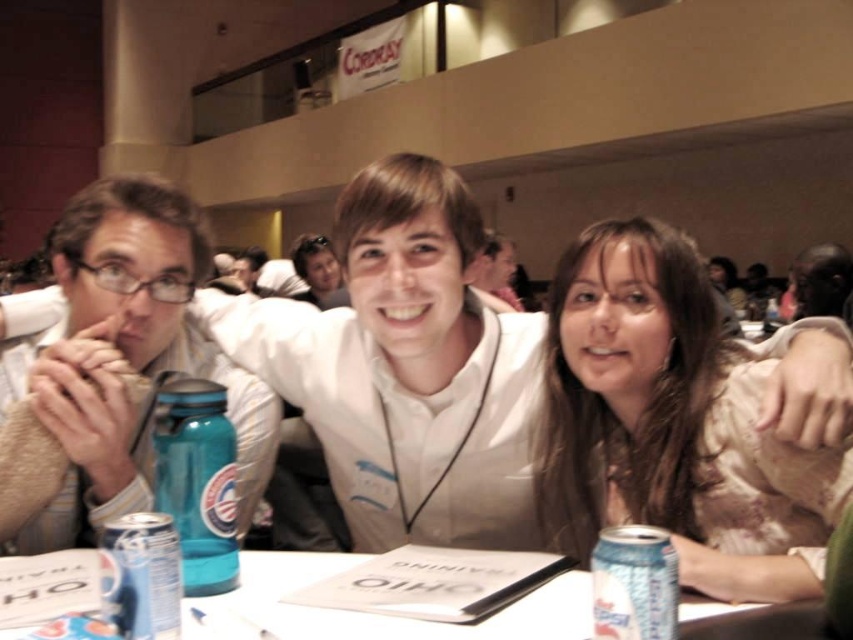
Does point (381, 257) lie behind point (809, 264)?

No, (381, 257) is in front of (809, 264).

Find the location of a particular element. This screenshot has height=640, width=853. matte white shirt at center is located at coordinates (405, 365).

Does point (206, 600) lie in front of point (137, 600)?

No, (206, 600) is further to viewer.

Is point (260, 628) in front of point (146, 598)?

No, (260, 628) is behind (146, 598).

You are a GUI agent. You are given a task and a screenshot of the screen. Output one action in this format:
    pyautogui.click(x=<x>, y=<y>)
    Task: Click on the clear plastic can at lower center
    This screenshot has width=853, height=640.
    Given the screenshot: What is the action you would take?
    pyautogui.click(x=367, y=612)

From the picture: Does clear plastic can at lower center have a larger size compared to smooth black hair at upper right?

Actually, clear plastic can at lower center might be smaller than smooth black hair at upper right.

Who is more distant from viewer, (566, 577) or (843, 260)?

The point (843, 260) is behind.

I want to click on clear plastic can at lower center, so click(x=367, y=612).